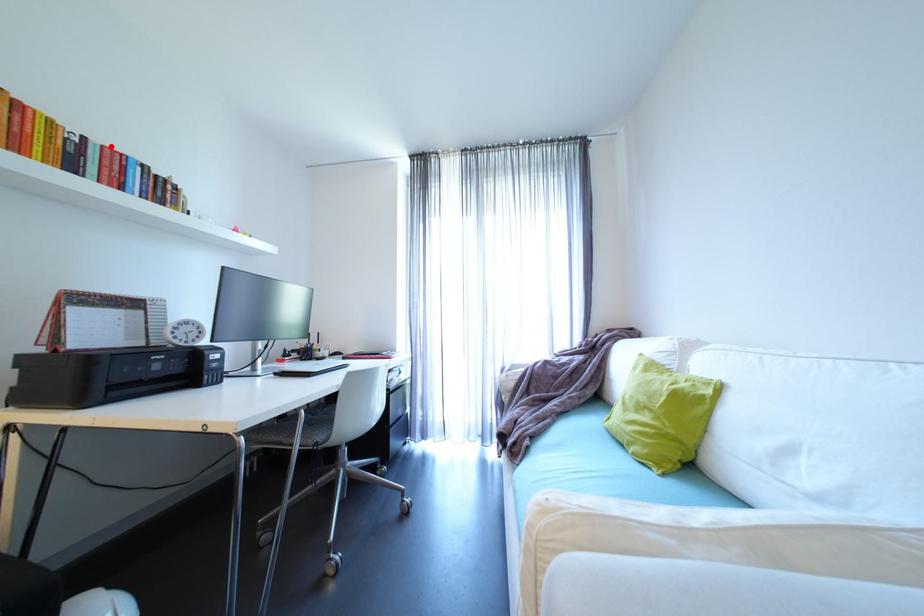
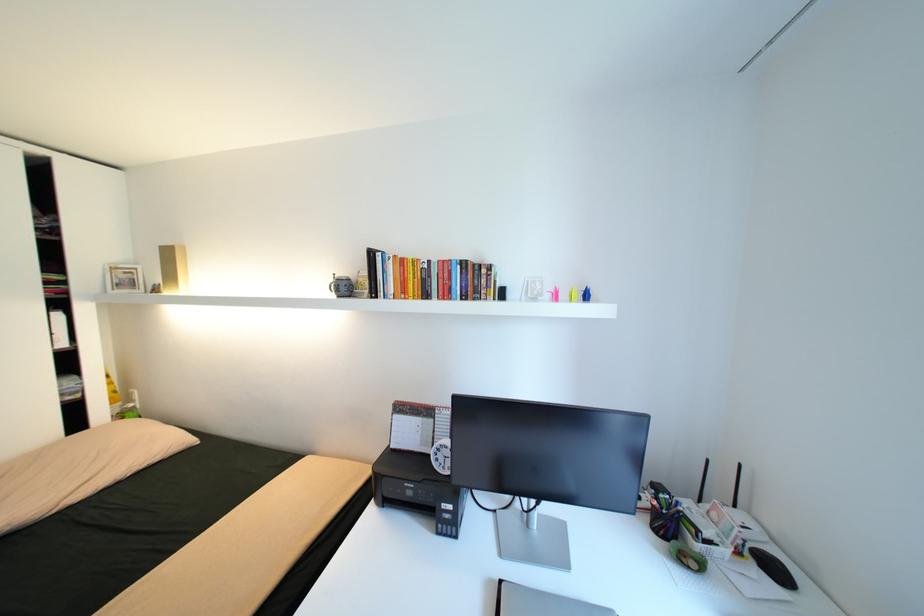
Locate, in the second image, the point that corresponds to the highlighted location in the first image.

(445, 262)